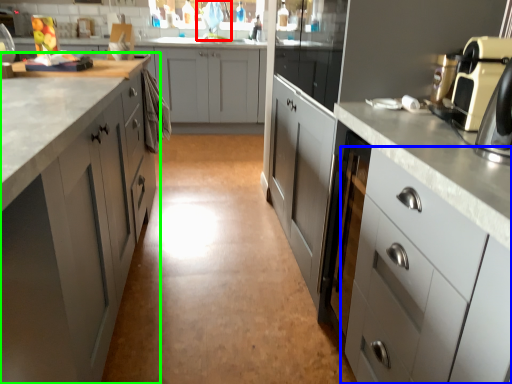
Question: Based on their relative distances, which object is nearer to faucet (highlighted by a red box)? Choose from cabinetry (highlighted by a blue box) and cabinetry (highlighted by a green box).

Choices:
 (A) cabinetry
 (B) cabinetry

Answer: (B)